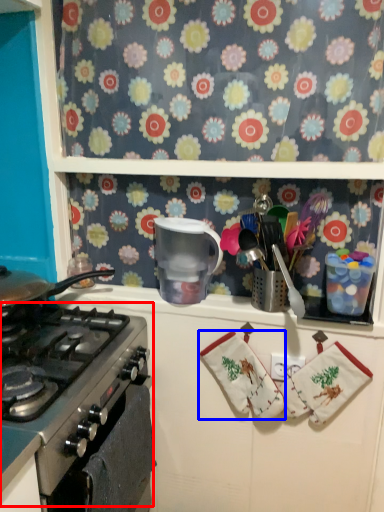
Question: Which point is closer to the camera, gas stove (highlighted by a red box) or hand towel (highlighted by a blue box)?

Choices:
 (A) gas stove
 (B) hand towel

Answer: (A)